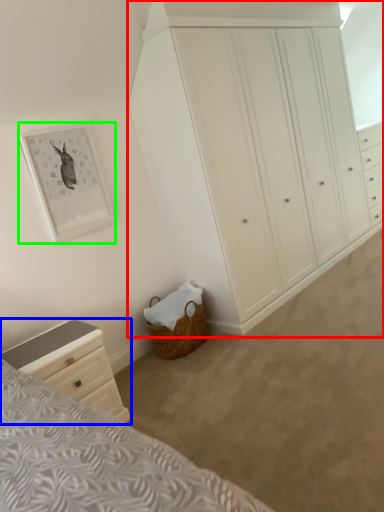
Question: Which object is positioned closest to chest of drawers (highlighted by a red box)? Select from chest of drawers (highlighted by a blue box) and picture frame (highlighted by a green box).

Choices:
 (A) chest of drawers
 (B) picture frame

Answer: (B)